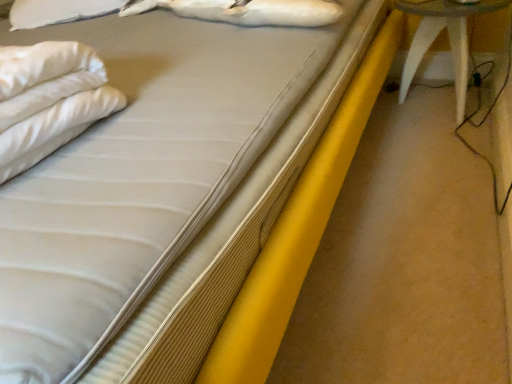
Question: Considering the relative positions of white fur animal at upper center and white plastic stool at right in the image provided, is white fur animal at upper center to the left or to the right of white plastic stool at right?

Choices:
 (A) right
 (B) left

Answer: (B)

Question: From the image's perspective, relative to white plastic stool at right, is white fur animal at upper center above or below?

Choices:
 (A) below
 (B) above

Answer: (B)

Question: Would you say white fur animal at upper center is inside or outside white plastic stool at right?

Choices:
 (A) outside
 (B) inside

Answer: (A)

Question: Relative to white fur animal at upper center, is white plastic stool at right in front or behind?

Choices:
 (A) behind
 (B) front

Answer: (A)

Question: From a real-world perspective, relative to white fur animal at upper center, is white plastic stool at right vertically above or below?

Choices:
 (A) above
 (B) below

Answer: (B)

Question: In the image, is white plastic stool at right on the left side or the right side of white fur animal at upper center?

Choices:
 (A) right
 (B) left

Answer: (A)

Question: Considering the positions of white plastic stool at right and white fur animal at upper center in the image, is white plastic stool at right taller or shorter than white fur animal at upper center?

Choices:
 (A) tall
 (B) short

Answer: (A)